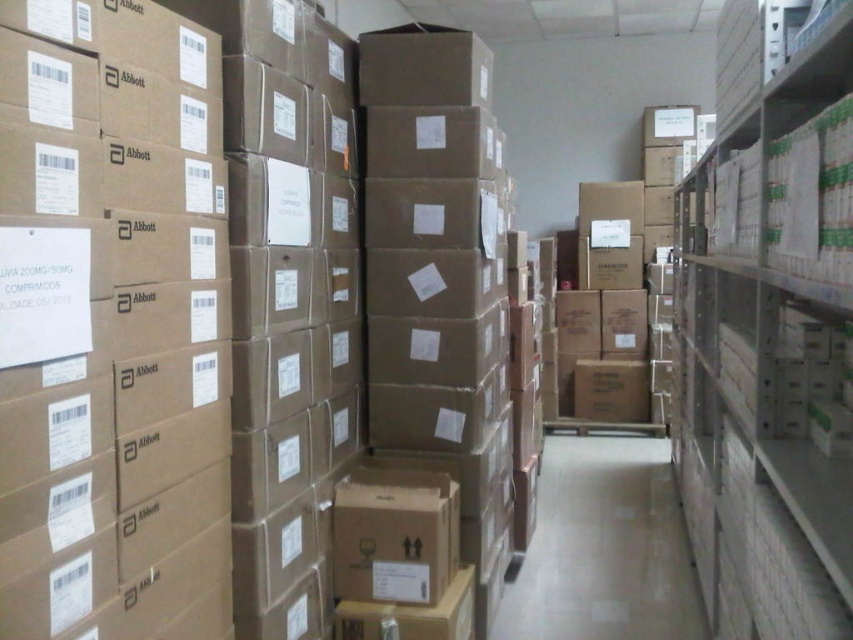
Question: Among these points, which one is farthest from the camera?

Choices:
 (A) click(614, 502)
 (B) click(747, 388)

Answer: (A)

Question: Is white cardboard boxes at right to the left of white glossy aisle at center from the viewer's perspective?

Choices:
 (A) no
 (B) yes

Answer: (A)

Question: Can you confirm if white cardboard boxes at right is positioned to the left of white glossy aisle at center?

Choices:
 (A) no
 (B) yes

Answer: (A)

Question: Among these points, which one is nearest to the camera?

Choices:
 (A) (534, 531)
 (B) (746, 252)

Answer: (B)

Question: Can you confirm if white cardboard boxes at right is positioned to the left of white glossy aisle at center?

Choices:
 (A) yes
 (B) no

Answer: (B)